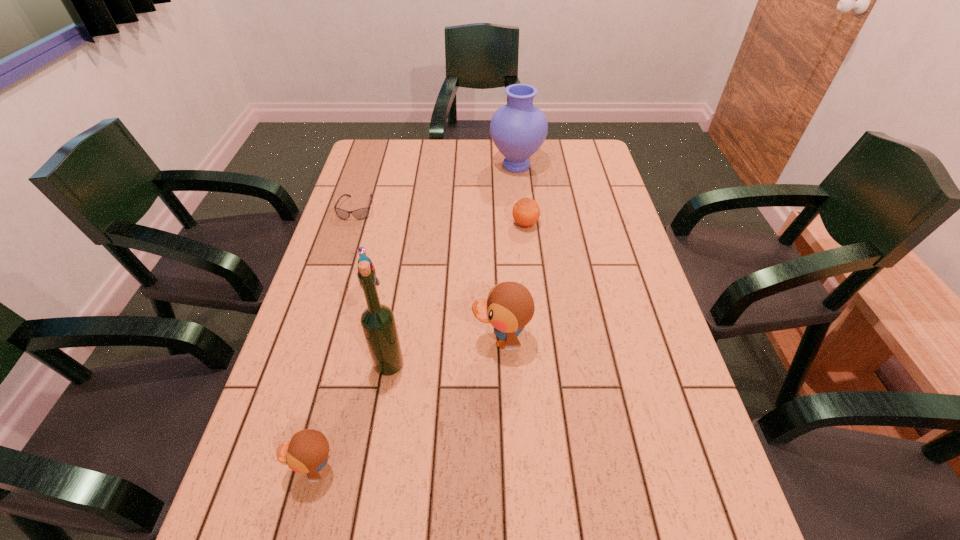
Identify the location of free spot between the nearer duck and the liquor. (351, 416).

What are the coordinates of `vacant space that is in between the soda and the shortest object` in the screenshot? It's located at (363, 245).

At what (x,y) coordinates should I click in order to perform the action: click on free space between the liquor and the farther duck. Please return your answer as a coordinate pair (x, y). The height and width of the screenshot is (540, 960). Looking at the image, I should click on (445, 352).

You are a GUI agent. You are given a task and a screenshot of the screen. Output one action in this format:
    pyautogui.click(x=<x>, y=<y>)
    Task: Click on the empty space between the farthest object and the fourth farthest object
    
    Given the screenshot: What is the action you would take?
    pyautogui.click(x=443, y=224)

At what (x,y) coordinates should I click in order to perform the action: click on unoccupied position between the farther duck and the orange. Please return your answer as a coordinate pair (x, y). Image resolution: width=960 pixels, height=540 pixels. Looking at the image, I should click on (514, 282).

This screenshot has width=960, height=540. What are the coordinates of `object that stands as the fourth closest to the sunglasses` in the screenshot? It's located at (378, 323).

Choose which object is the third nearest neighbor to the shortest object. Please provide its 2D coordinates. Your answer should be formatted as a tuple, i.e. [(x, y)], where the tuple contains the x and y coordinates of a point satisfying the conditions above.

[(526, 211)]

This screenshot has height=540, width=960. I want to click on free space that satisfies the following two spatial constraints: 1. on the front side of the farthest object; 2. on the front-facing side of the right duck, so click(535, 340).

This screenshot has height=540, width=960. I want to click on vacant space that satisfies the following two spatial constraints: 1. on the lenses of the second shortest object; 2. on the right side of the shortest object, so click(351, 224).

Where is `vacant space that satisfies the following two spatial constraints: 1. on the front-facing side of the taller duck; 2. on the front side of the liquor`? The height and width of the screenshot is (540, 960). vacant space that satisfies the following two spatial constraints: 1. on the front-facing side of the taller duck; 2. on the front side of the liquor is located at coordinates (502, 364).